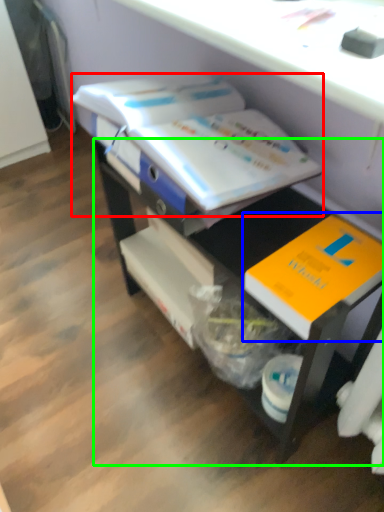
Question: Estimate the real-world distances between objects in this image. Which object is closer to book (highlighted by a red box), book (highlighted by a blue box) or desk (highlighted by a green box)?

Choices:
 (A) book
 (B) desk

Answer: (B)